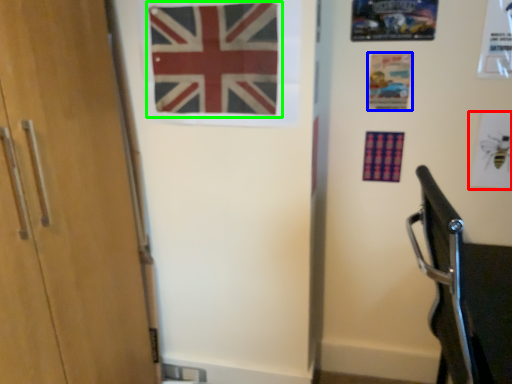
Question: Considering the real-world distances, which object is closest to postcard (highlighted by a red box)? postcard (highlighted by a blue box) or flag (highlighted by a green box).

Choices:
 (A) postcard
 (B) flag

Answer: (A)